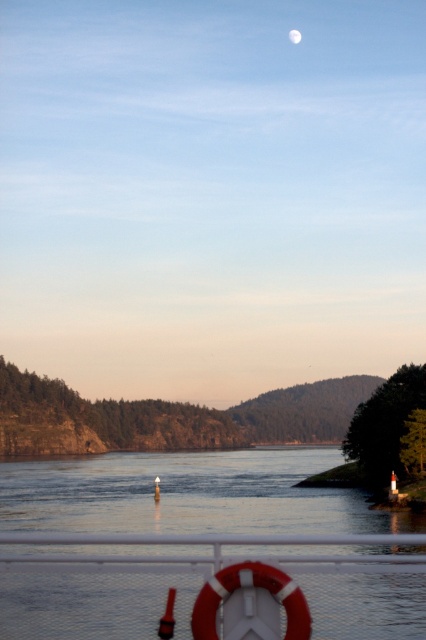
Question: Which point is closer to the camera?

Choices:
 (A) pos(36,536)
 (B) pos(299,33)

Answer: (A)

Question: In this image, where is white plastic lifebuoy at lower center located relative to silvery reflective moon at upper center?

Choices:
 (A) above
 (B) below

Answer: (B)

Question: From the image, what is the correct spatial relationship of white plastic lifebuoy at lower center in relation to silvery reflective moon at upper center?

Choices:
 (A) left
 (B) right

Answer: (A)

Question: Among these points, which one is farthest from the camera?

Choices:
 (A) (285, 570)
 (B) (299, 33)

Answer: (B)

Question: Does white plastic lifebuoy at lower center have a larger size compared to silvery reflective moon at upper center?

Choices:
 (A) no
 (B) yes

Answer: (A)